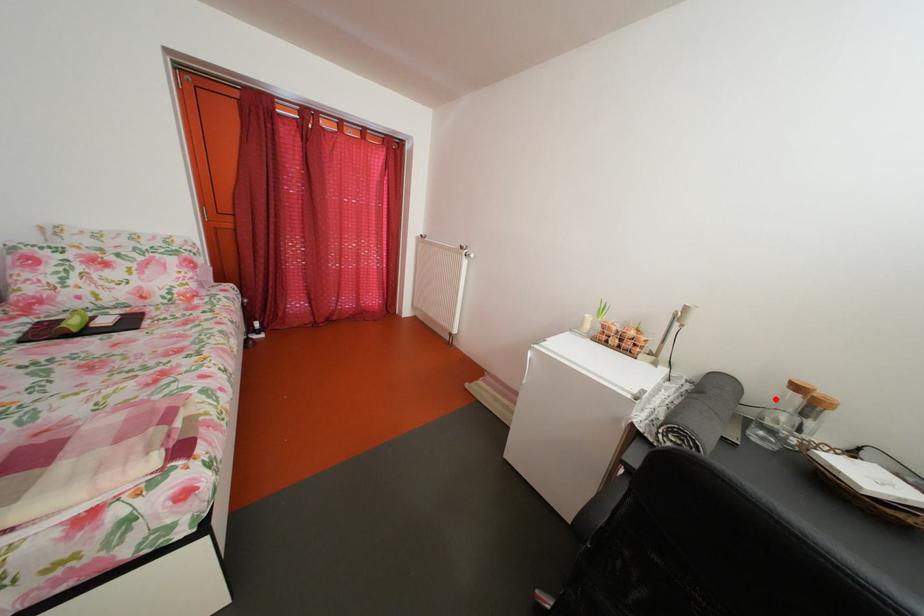
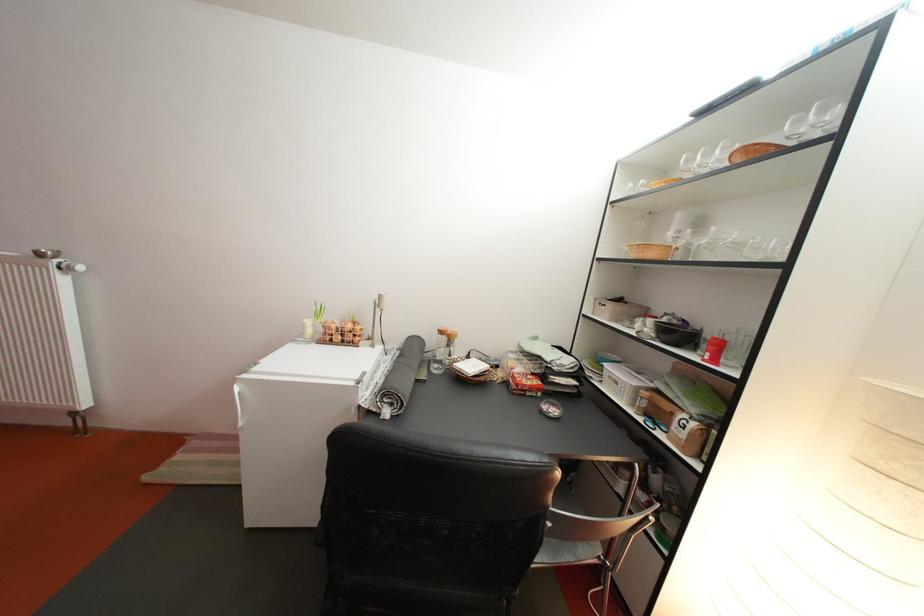
In the second image, find the point that corresponds to the highlighted location in the first image.

(444, 346)